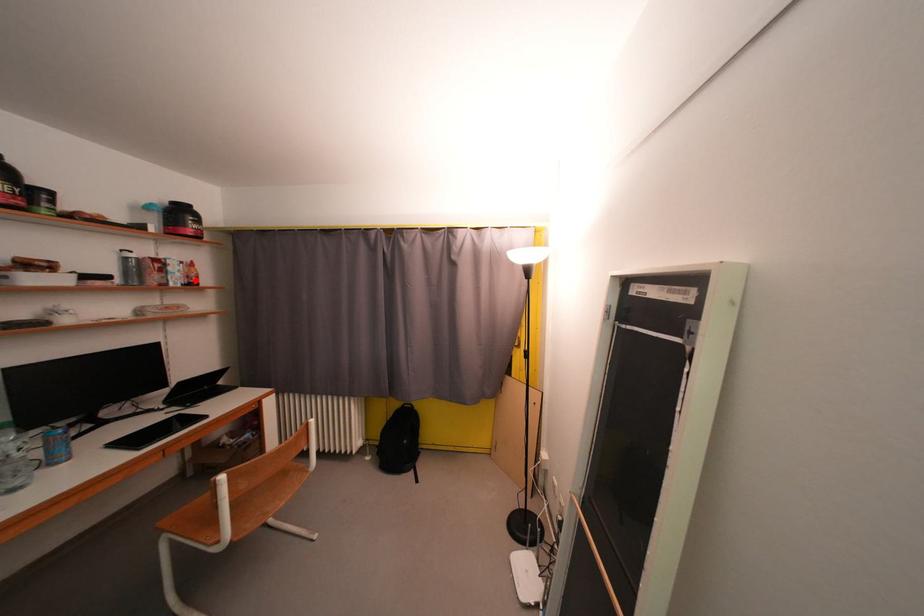
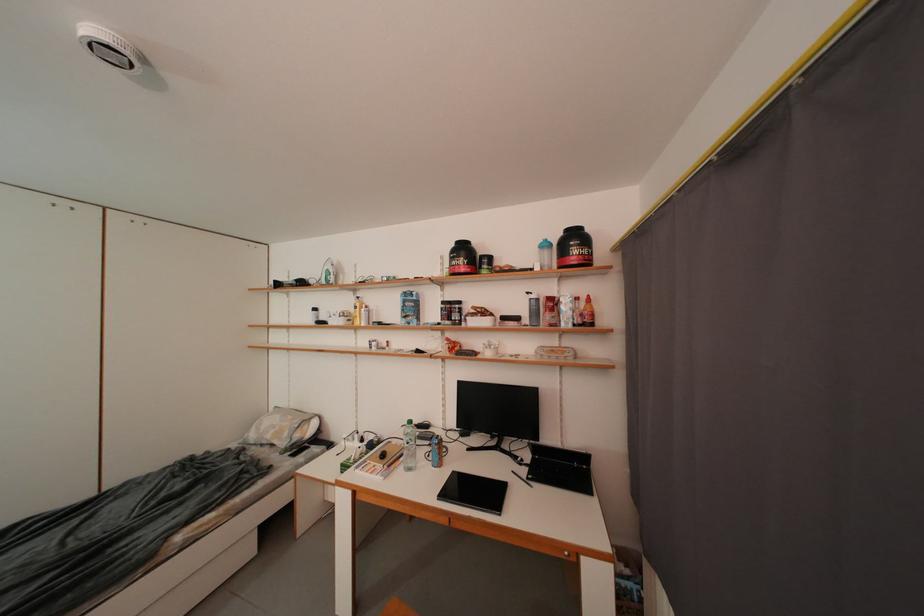
Locate, in the second image, the point that corresponds to the highlighted location in the first image.

(590, 318)